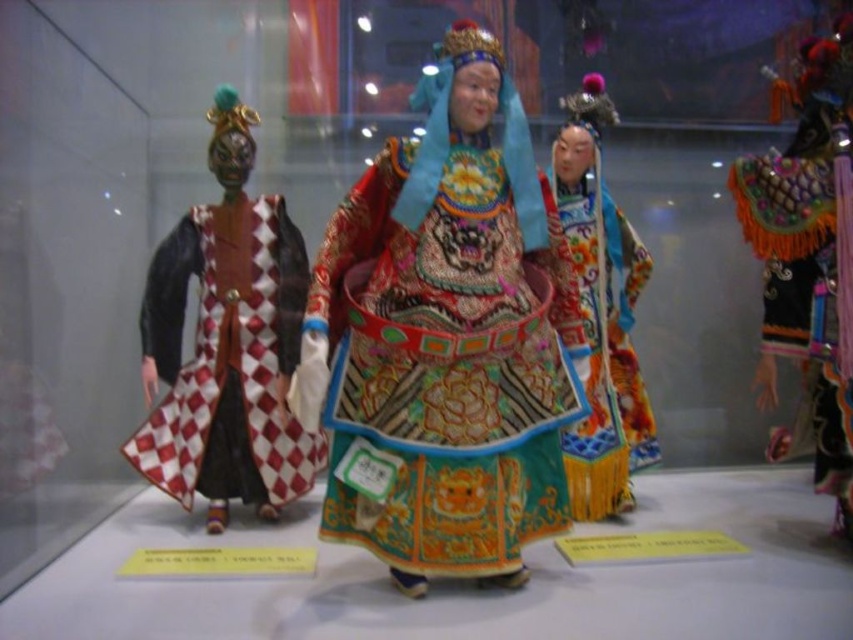
You are a photographer planning to take a portrait of both the red and white checkered fabric at left and the vibrant silk robe at center in the museum exhibit. The minimum distance your camera requires between subjects for optimal focus is 30 inches. Can you achieve optimal focus with the current spacing between them?

The red and white checkered fabric at left and vibrant silk robe at center are 35.25 inches apart from each other, which exceeds the minimum 30 inches required for optimal focus. Therefore, the photographer can achieve optimal focus with the current spacing between them.

You are a museum visitor who wants to take a photo of both the embroidered silk robe at center and the red and white checkered fabric at left. Based on their positions, which one should you focus on first to ensure both are in the frame?

You should focus on the embroidered silk robe at center first because it is positioned to the right of the red and white checkered fabric at left, so by centering the robe, the checkered fabric will naturally be included in the frame to its left.